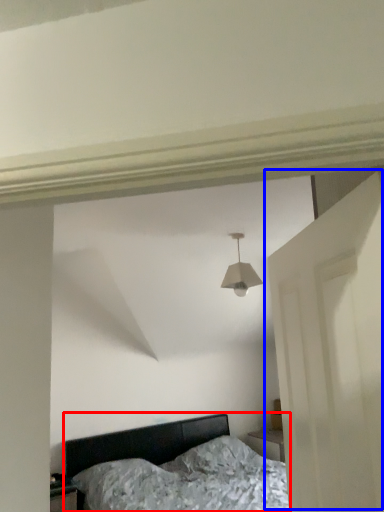
Question: Which object appears farthest to the camera in this image, bed (highlighted by a red box) or door (highlighted by a blue box)?

Choices:
 (A) bed
 (B) door

Answer: (A)